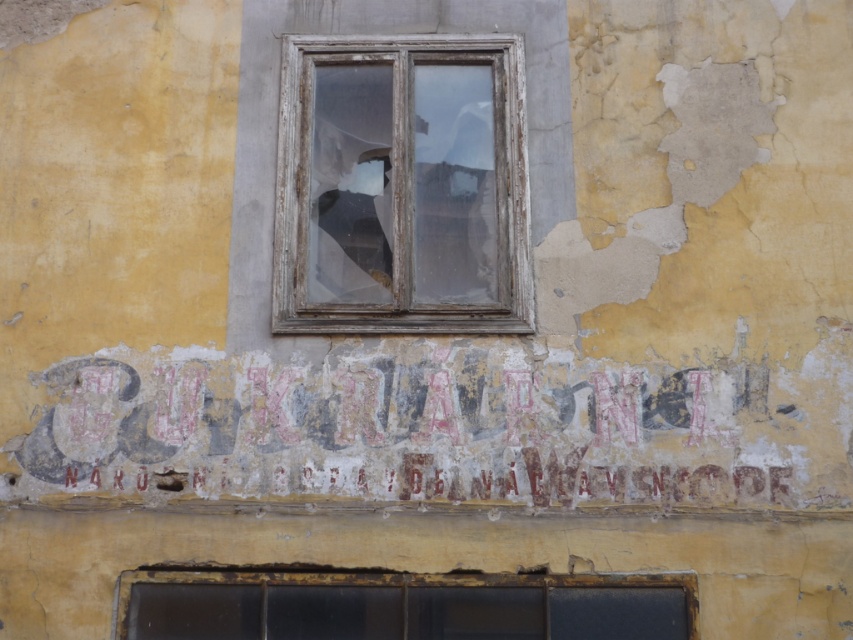
Question: Is faded red paint sign at center above matte glass window at lower center?

Choices:
 (A) yes
 (B) no

Answer: (A)

Question: Which point appears farthest from the camera in this image?

Choices:
 (A) (80, 476)
 (B) (515, 589)
 (C) (389, 256)

Answer: (C)

Question: Which object appears closest to the camera in this image?

Choices:
 (A) wooden-framed glass window at center
 (B) faded red paint sign at center
 (C) matte glass window at lower center

Answer: (C)

Question: Can you confirm if faded red paint sign at center is positioned below matte glass window at lower center?

Choices:
 (A) no
 (B) yes

Answer: (A)

Question: Does faded red paint sign at center appear over wooden-framed glass window at center?

Choices:
 (A) no
 (B) yes

Answer: (A)

Question: Estimate the real-world distances between objects in this image. Which object is closer to the faded red paint sign at center?

Choices:
 (A) matte glass window at lower center
 (B) wooden-framed glass window at center

Answer: (A)